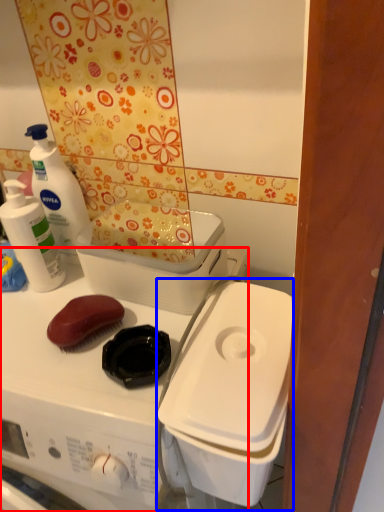
Question: Which of the following is the closest to the observer, washing machine (highlighted by a red box) or appliance (highlighted by a blue box)?

Choices:
 (A) washing machine
 (B) appliance

Answer: (A)